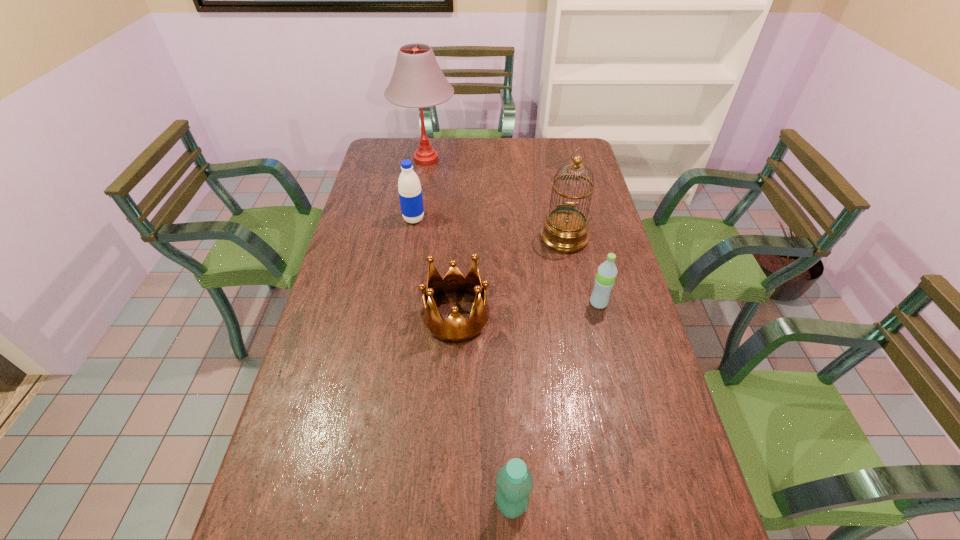
This screenshot has width=960, height=540. What are the coordinates of `the tallest object` in the screenshot? It's located at (417, 82).

Image resolution: width=960 pixels, height=540 pixels. I want to click on table lamp, so click(x=417, y=82).

At what (x,y) coordinates should I click in order to perform the action: click on birdcage. Please return your answer as a coordinate pair (x, y). Looking at the image, I should click on (565, 229).

Find the location of a particular element. the third tallest object is located at coordinates (410, 193).

I want to click on the farthest water bottle, so click(x=410, y=193).

You are a GUI agent. You are given a task and a screenshot of the screen. Output one action in this format:
    pyautogui.click(x=<x>, y=<y>)
    Task: Click on the rightmost water bottle
    The height and width of the screenshot is (540, 960).
    Given the screenshot: What is the action you would take?
    pyautogui.click(x=607, y=271)

At what (x,y) coordinates should I click in order to perform the action: click on the nearest object. Please return your answer as a coordinate pair (x, y). This screenshot has width=960, height=540. Looking at the image, I should click on tap(515, 482).

What are the coordinates of `the second water bottle from right to left` in the screenshot? It's located at (515, 482).

Image resolution: width=960 pixels, height=540 pixels. Find the location of `crown`. crown is located at coordinates (456, 329).

Locate an element on the screen. This screenshot has height=540, width=960. free space located on the front-facing side of the farthest object is located at coordinates (514, 159).